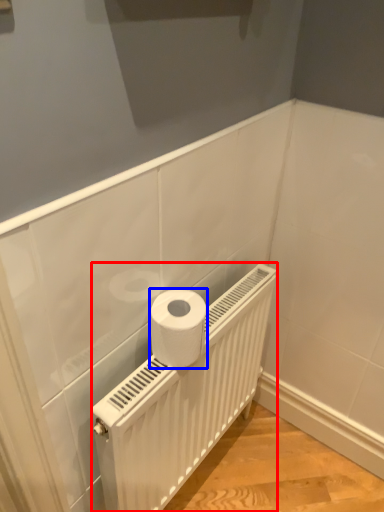
Question: Among these objects, which one is farthest to the camera, radiator (highlighted by a red box) or toilet paper (highlighted by a blue box)?

Choices:
 (A) radiator
 (B) toilet paper

Answer: (B)